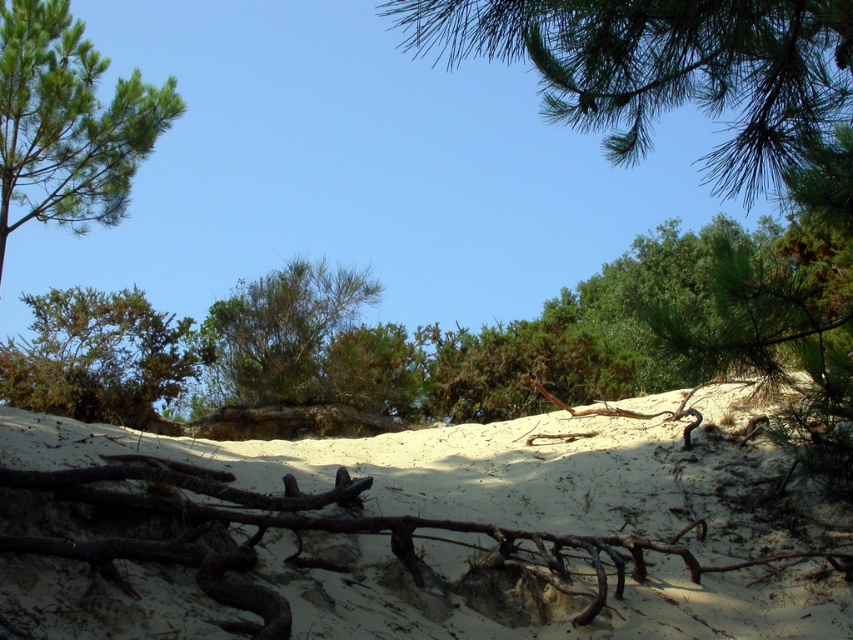
Between light beige sand at center and green needle-like at upper left, which one has more height?

green needle-like at upper left

Based on the photo, who is shorter, light beige sand at center or green needle-like at upper left?

Standing shorter between the two is light beige sand at center.

This screenshot has height=640, width=853. What are the coordinates of `light beige sand at center` in the screenshot? It's located at (413, 534).

Is green needle-like leaves at upper center to the left of green needle-like at upper left from the viewer's perspective?

In fact, green needle-like leaves at upper center is to the right of green needle-like at upper left.

In the scene shown: Can you confirm if green needle-like leaves at upper center is thinner than green needle-like at upper left?

In fact, green needle-like leaves at upper center might be wider than green needle-like at upper left.

At what (x,y) coordinates should I click in order to perform the action: click on green needle-like leaves at upper center. Please return your answer as a coordinate pair (x, y). Looking at the image, I should click on (666, 68).

Which is more to the right, green needle-like at upper left or green leafy shrub at left?

green leafy shrub at left

Which is behind, point (143, 112) or point (117, 412)?

Point (143, 112)

Where is `green needle-like at upper left`? The height and width of the screenshot is (640, 853). green needle-like at upper left is located at coordinates (67, 122).